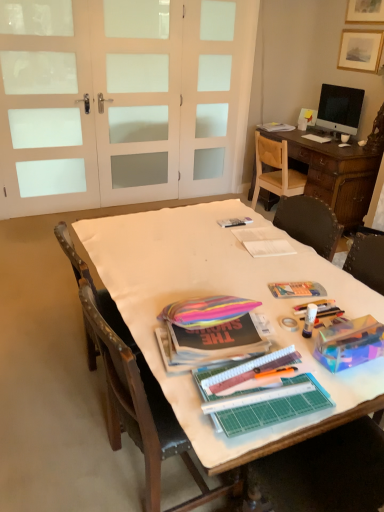
Question: Is white frosted glass screen door at upper center, placed as the 1th screen door when sorted from right to left, outside of white fabric-covered table at center?

Choices:
 (A) yes
 (B) no

Answer: (A)

Question: Is the position of white frosted glass screen door at upper center, which is the third screen door from left to right, less distant than that of white fabric-covered table at center?

Choices:
 (A) no
 (B) yes

Answer: (A)

Question: Considering the relative positions of white frosted glass screen door at upper center, placed as the 1th screen door when sorted from right to left, and white fabric-covered table at center in the image provided, is white frosted glass screen door at upper center, placed as the 1th screen door when sorted from right to left, to the left of white fabric-covered table at center from the viewer's perspective?

Choices:
 (A) yes
 (B) no

Answer: (B)

Question: Is white frosted glass screen door at upper center, placed as the 1th screen door when sorted from right to left, not near white fabric-covered table at center?

Choices:
 (A) yes
 (B) no

Answer: (A)

Question: Is white frosted glass screen door at upper center, placed as the 1th screen door when sorted from right to left, bigger than white fabric-covered table at center?

Choices:
 (A) yes
 (B) no

Answer: (B)

Question: From a real-world perspective, relative to rainbow fabric bag at center, which appears as the 1th magazine when ordered from the bottom, is wooden chair at right, positioned as the second chair in front-to-back order, vertically above or below?

Choices:
 (A) above
 (B) below

Answer: (B)

Question: Based on their positions, is wooden chair at right, arranged as the 1th chair when viewed from the back, located to the left or right of rainbow fabric bag at center, which appears as the 1th magazine when ordered from the bottom?

Choices:
 (A) left
 (B) right

Answer: (B)

Question: Is wooden chair at right, which is the 2th chair from bottom to top, inside the boundaries of rainbow fabric bag at center, arranged as the 1th magazine when viewed from the left, or outside?

Choices:
 (A) outside
 (B) inside

Answer: (A)

Question: Relative to rainbow fabric bag at center, which ranks as the 3th magazine in right-to-left order, is wooden chair at right, which is counted as the 1th chair, starting from the top, in front or behind?

Choices:
 (A) front
 (B) behind

Answer: (B)

Question: Is white fabric-covered table at center spatially inside matte paper magazine at center, the second magazine positioned from the bottom, or outside of it?

Choices:
 (A) outside
 (B) inside

Answer: (A)

Question: From a real-world perspective, is white fabric-covered table at center above or below matte paper magazine at center, which appears as the second magazine when viewed from the left?

Choices:
 (A) below
 (B) above

Answer: (A)

Question: Considering the positions of white fabric-covered table at center and matte paper magazine at center, positioned as the second magazine in top-to-bottom order, in the image, is white fabric-covered table at center taller or shorter than matte paper magazine at center, positioned as the second magazine in top-to-bottom order,?

Choices:
 (A) tall
 (B) short

Answer: (A)

Question: Would you say white fabric-covered table at center is to the left or to the right of matte paper magazine at center, the 2th magazine from the back, in the picture?

Choices:
 (A) right
 (B) left

Answer: (B)

Question: From the image's perspective, is white paper at center above or below white fabric-covered table at center?

Choices:
 (A) below
 (B) above

Answer: (B)

Question: Is white paper at center inside or outside of white fabric-covered table at center?

Choices:
 (A) outside
 (B) inside

Answer: (A)